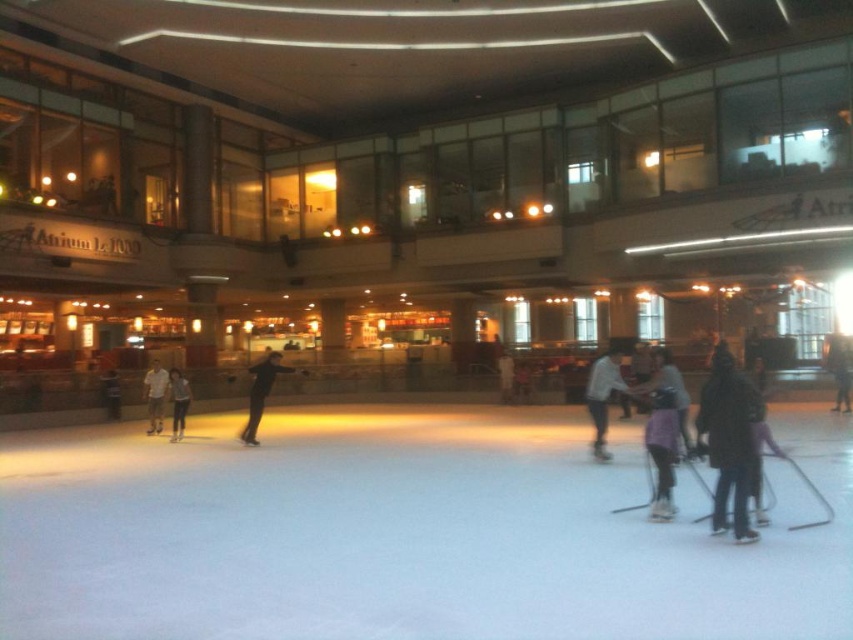
In the scene shown: Which is above, white smooth ice at center or light gray sweater at center?

Positioned higher is light gray sweater at center.

From the picture: Who is more forward, (334, 637) or (610, 368)?

Positioned in front is point (334, 637).

You are a GUI agent. You are given a task and a screenshot of the screen. Output one action in this format:
    pyautogui.click(x=<x>, y=<y>)
    Task: Click on the white smooth ice at center
    
    Given the screenshot: What is the action you would take?
    pyautogui.click(x=405, y=534)

Between point (730, 392) and point (688, 392), which one is positioned in front?

Point (730, 392) is more forward.

Does black matte jacket at lower right have a larger size compared to purple fabric jacket at lower right?

Yes, black matte jacket at lower right is bigger than purple fabric jacket at lower right.

Is point (740, 531) positioned before point (682, 419)?

Yes, point (740, 531) is closer to viewer.

Locate an element on the screen. black matte jacket at lower right is located at coordinates (728, 442).

Is white smooth ice at center bigger than black matte figure skater at center?

No, white smooth ice at center is not bigger than black matte figure skater at center.

Is point (339, 609) less distant than point (260, 376)?

Yes, it is in front of point (260, 376).

Between point (375, 630) and point (258, 380), which one is positioned behind?

The point (258, 380) is more distant.

The width and height of the screenshot is (853, 640). Find the location of `white smooth ice at center`. white smooth ice at center is located at coordinates (405, 534).